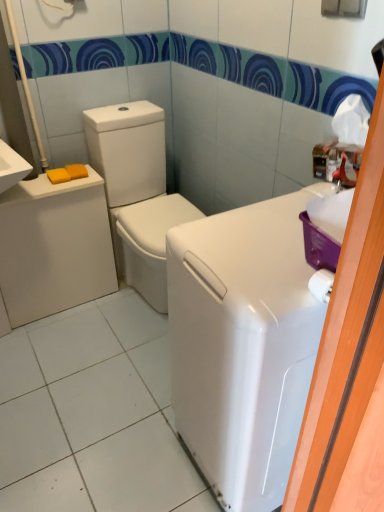
Measure the distance between white glossy washer at center and camera.

The depth of white glossy washer at center is 5.55 feet.

What do you see at coordinates (137, 192) in the screenshot? I see `white glossy washer at center` at bounding box center [137, 192].

Locate an element on the screen. Image resolution: width=384 pixels, height=512 pixels. yellow matte soap at left, the 1th soap viewed from the left is located at coordinates (58, 175).

Describe the element at coordinates (76, 170) in the screenshot. I see `yellow matte soap at left, placed as the 1th soap when sorted from right to left` at that location.

Locate an element on the screen. white glossy washer at center is located at coordinates (137, 192).

From the picture: From a real-world perspective, who is located higher, white glossy washer at center or white glossy washing machine at right?

In real-world perspective, white glossy washing machine at right is above.

Between point (126, 228) and point (307, 384), which one is positioned behind?

The point (126, 228) is farther.

Which object is closer to the camera, white glossy washer at center or white glossy washing machine at right?

Positioned in front is white glossy washing machine at right.

Is white glossy washer at center spatially inside white glossy washing machine at right, or outside of it?

white glossy washer at center is spatially situated outside white glossy washing machine at right.

Could you tell me if yellow matte soap at left, which is counted as the 2th soap, starting from the left, is turned towards yellow matte soap at left, the 1th soap viewed from the left?

No, yellow matte soap at left, which is counted as the 2th soap, starting from the left, does not turn towards yellow matte soap at left, the 1th soap viewed from the left.

From a real-world perspective, who is located lower, yellow matte soap at left, placed as the 1th soap when sorted from right to left, or yellow matte soap at left, positioned as the second soap in right-to-left order?

yellow matte soap at left, positioned as the second soap in right-to-left order.

Is yellow matte soap at left, which is counted as the 2th soap, starting from the left, to the left of yellow matte soap at left, positioned as the second soap in right-to-left order, from the viewer's perspective?

No, yellow matte soap at left, which is counted as the 2th soap, starting from the left, is not to the left of yellow matte soap at left, positioned as the second soap in right-to-left order.

How much distance is there between yellow matte soap at left, placed as the 1th soap when sorted from right to left, and yellow matte soap at left, positioned as the second soap in right-to-left order?

The distance of yellow matte soap at left, placed as the 1th soap when sorted from right to left, from yellow matte soap at left, positioned as the second soap in right-to-left order, is 1.71 inches.

Does white glossy washer at center turn towards matte white porcelain at left?

No, white glossy washer at center does not turn towards matte white porcelain at left.

Identify the location of washer above the matte white porcelain at left (from the image's perspective). The height and width of the screenshot is (512, 384). (137, 192).

Does white glossy washer at center come behind matte white porcelain at left?

No, white glossy washer at center is closer to the viewer.

Which is in front, point (267, 315) or point (141, 172)?

The point (267, 315) is in front.

Consider the image. Is white glossy washer at center located within white glossy washing machine at right?

No, white glossy washing machine at right does not contain white glossy washer at center.

From the picture: Which of these two, white glossy washing machine at right or white glossy washer at center, is thinner?

white glossy washing machine at right.

Looking at this image, does white glossy washing machine at right turn towards white glossy washer at center?

No, white glossy washing machine at right is not oriented towards white glossy washer at center.

Which object is positioned more to the left, matte white porcelain at left or yellow matte soap at left, placed as the 1th soap when sorted from right to left?

Positioned to the left is matte white porcelain at left.

In the scene shown: Considering the sizes of matte white porcelain at left and yellow matte soap at left, which is counted as the 2th soap, starting from the left, in the image, is matte white porcelain at left taller or shorter than yellow matte soap at left, which is counted as the 2th soap, starting from the left,?

Clearly, matte white porcelain at left is taller compared to yellow matte soap at left, which is counted as the 2th soap, starting from the left.

Considering the positions of points (26, 256) and (71, 168), is point (26, 256) closer to camera compared to point (71, 168)?

Yes, point (26, 256) is closer to viewer.

Is matte white porcelain at left oriented towards yellow matte soap at left, which is counted as the 2th soap, starting from the left?

No, matte white porcelain at left is not turned towards yellow matte soap at left, which is counted as the 2th soap, starting from the left.

Would you consider matte white porcelain at left to be distant from yellow matte soap at left, positioned as the second soap in right-to-left order?

matte white porcelain at left is actually quite close to yellow matte soap at left, positioned as the second soap in right-to-left order.

Relative to yellow matte soap at left, positioned as the second soap in right-to-left order, is matte white porcelain at left in front or behind?

Clearly, matte white porcelain at left is in front of yellow matte soap at left, positioned as the second soap in right-to-left order.

In terms of height, does matte white porcelain at left look taller or shorter compared to yellow matte soap at left, positioned as the second soap in right-to-left order?

matte white porcelain at left is taller than yellow matte soap at left, positioned as the second soap in right-to-left order.

Would you say matte white porcelain at left is part of white glossy washing machine at right's contents?

Definitely not — matte white porcelain at left is not inside white glossy washing machine at right.

Considering the relative sizes of white glossy washing machine at right and matte white porcelain at left in the image provided, is white glossy washing machine at right thinner than matte white porcelain at left?

No.

Is white glossy washing machine at right touching matte white porcelain at left?

They are not placed beside each other.

You are a GUI agent. You are given a task and a screenshot of the screen. Output one action in this format:
    pyautogui.click(x=<x>, y=<y>)
    Task: Click on the washer to the left of white glossy washing machine at right
    The width and height of the screenshot is (384, 512).
    Given the screenshot: What is the action you would take?
    [x=137, y=192]

Identify the location of soap located behind the yellow matte soap at left, positioned as the second soap in right-to-left order. This screenshot has width=384, height=512. (76, 170).

Looking at the image, which one is located further to matte white porcelain at left, white glossy washer at center or yellow matte soap at left, the 1th soap viewed from the left?

yellow matte soap at left, the 1th soap viewed from the left, is further to matte white porcelain at left.

When comparing their distances from matte white porcelain at left, does white glossy washing machine at right or yellow matte soap at left, positioned as the second soap in right-to-left order, seem closer?

yellow matte soap at left, positioned as the second soap in right-to-left order.

From the picture: Looking at the image, which one is located closer to white glossy washing machine at right, yellow matte soap at left, which is counted as the 2th soap, starting from the left, or matte white porcelain at left?

Among the two, matte white porcelain at left is located nearer to white glossy washing machine at right.

Which object lies further to the anchor point white glossy washer at center, yellow matte soap at left, which is counted as the 2th soap, starting from the left, or yellow matte soap at left, the 1th soap viewed from the left?

yellow matte soap at left, the 1th soap viewed from the left.

Which object lies nearer to the anchor point matte white porcelain at left, yellow matte soap at left, the 1th soap viewed from the left, or white glossy washing machine at right?

yellow matte soap at left, the 1th soap viewed from the left, lies closer to matte white porcelain at left than the other object.

Which object lies nearer to the anchor point white glossy washer at center, matte white porcelain at left or white glossy washing machine at right?

The object closer to white glossy washer at center is matte white porcelain at left.

Considering their positions, is matte white porcelain at left positioned closer to white glossy washing machine at right than white glossy washer at center?

white glossy washer at center is positioned closer to the anchor white glossy washing machine at right.

From the image, which object appears to be nearer to yellow matte soap at left, positioned as the second soap in right-to-left order, white glossy washer at center or white glossy washing machine at right?

Based on the image, white glossy washer at center appears to be nearer to yellow matte soap at left, positioned as the second soap in right-to-left order.

Locate an element on the screen. washer between white glossy washing machine at right and yellow matte soap at left, positioned as the second soap in right-to-left order, from front to back is located at coordinates (137, 192).

The image size is (384, 512). What are the coordinates of `washer located between matte white porcelain at left and white glossy washing machine at right in the left-right direction` in the screenshot? It's located at (137, 192).

Find the location of a particular element. This screenshot has height=512, width=384. porcelain located between white glossy washing machine at right and yellow matte soap at left, positioned as the second soap in right-to-left order, in the depth direction is located at coordinates (54, 246).

Identify the location of soap between white glossy washing machine at right and yellow matte soap at left, placed as the 1th soap when sorted from right to left, from front to back. This screenshot has height=512, width=384. (58, 175).